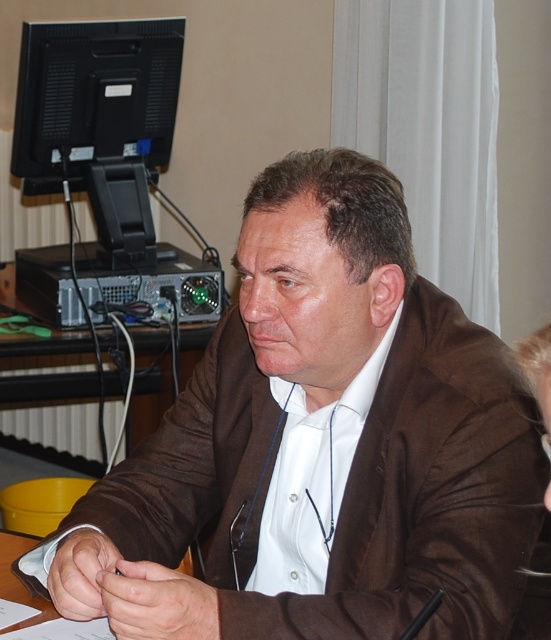
You are a delivery person who needs to place a small package between the brown fabric jacket at center and the black matte monitor at upper left on the desk. Can you fit the package there if it measures 1 meter in length?

The brown fabric jacket at center and the black matte monitor at upper left are 1.36 meters apart, so yes, the package measuring 1 meter in length can fit between them since the space is larger than the package.

What object is located at the coordinates point (320, 445)?

The brown fabric jacket at center is located at point (320, 445).